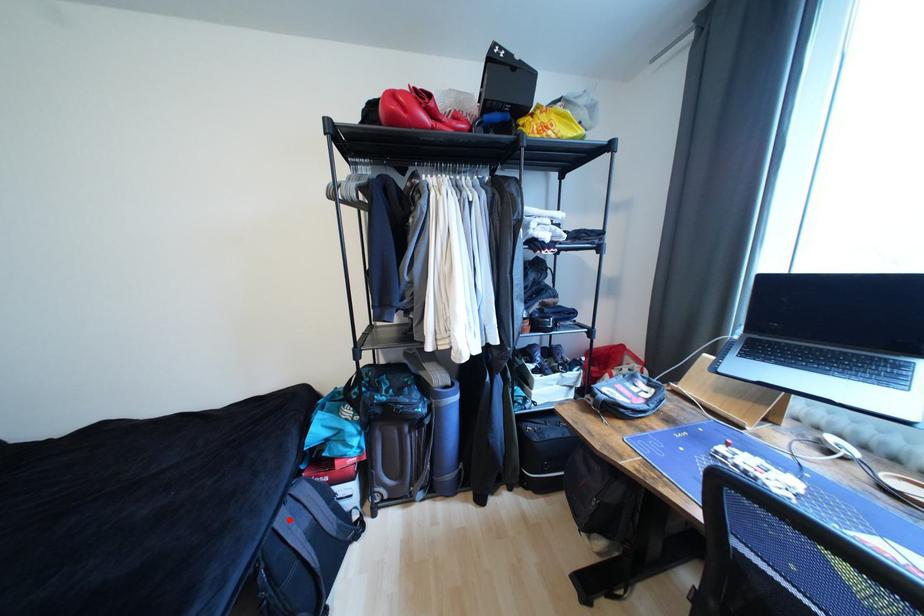
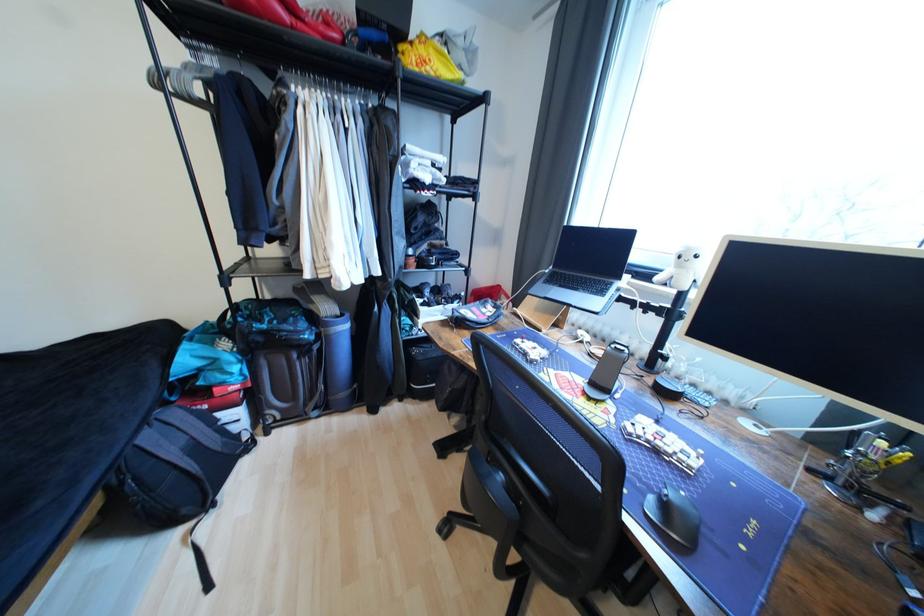
Question: I am providing you with two images of the same scene from different viewpoints. Given a red point in image1, look at the same physical point in image2. Is it:

Choices:
 (A) Closer to the viewpoint
 (B) Farther from the viewpoint

Answer: (B)